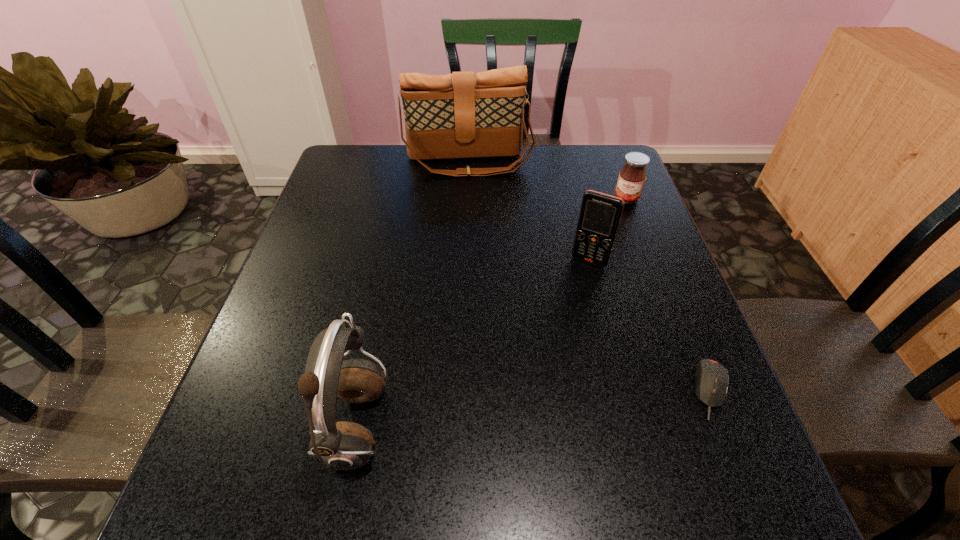
Find the location of a particular element. computer mouse that is at the near edge is located at coordinates (711, 378).

The height and width of the screenshot is (540, 960). In order to click on computer mouse that is at the right edge in this screenshot , I will do `click(711, 378)`.

Locate an element on the screen. The height and width of the screenshot is (540, 960). jam that is at the right edge is located at coordinates (632, 177).

The width and height of the screenshot is (960, 540). I want to click on cellular telephone that is at the right edge, so click(600, 214).

Where is `object situated at the near right corner`? The height and width of the screenshot is (540, 960). object situated at the near right corner is located at coordinates (711, 378).

The image size is (960, 540). I want to click on free space at the far edge, so click(417, 173).

Identify the location of free space at the near edge of the desktop. (377, 430).

This screenshot has height=540, width=960. What are the coordinates of `vacant space at the left edge of the desktop` in the screenshot? It's located at (309, 280).

I want to click on vacant region at the far left corner of the desktop, so click(x=361, y=157).

I want to click on free area in between the third farthest object and the computer mouse, so click(651, 326).